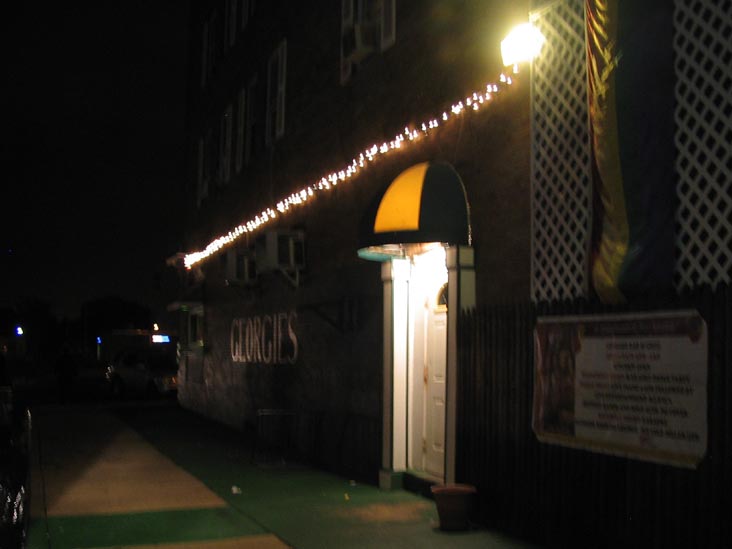
Locate an element on the screen. Image resolution: width=732 pixels, height=549 pixels. air conditioner is located at coordinates (277, 247).